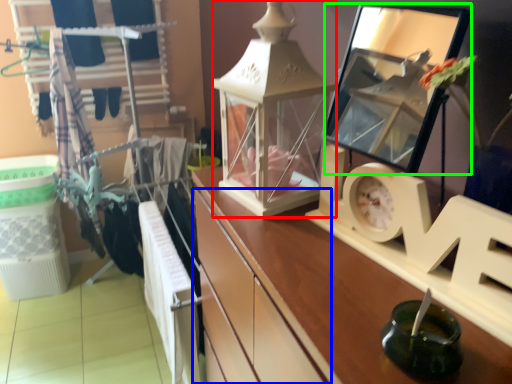
Question: Considering the real-world distances, which object is closest to writing (highlighted by a red box)? drawer (highlighted by a blue box) or mirror (highlighted by a green box).

Choices:
 (A) drawer
 (B) mirror

Answer: (A)